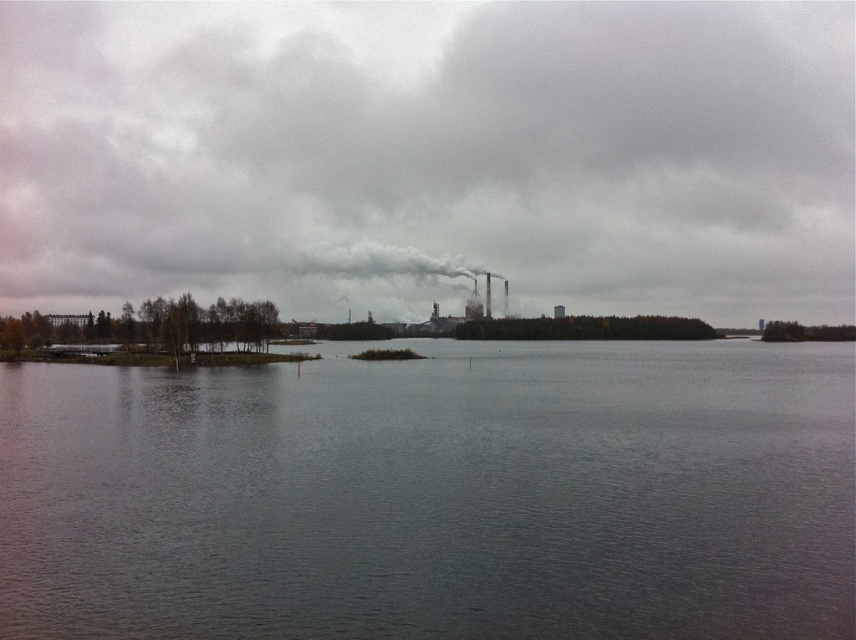
Question: Which of the following is the farthest from the observer?

Choices:
 (A) (378, 252)
 (B) (355, 413)

Answer: (A)

Question: Can you confirm if gray water at center is bigger than white smoke at center?

Choices:
 (A) no
 (B) yes

Answer: (A)

Question: Is gray water at center wider than white smoke at center?

Choices:
 (A) yes
 (B) no

Answer: (A)

Question: Among these points, which one is farthest from the camera?

Choices:
 (A) (480, 285)
 (B) (96, 452)

Answer: (A)

Question: Is gray water at center below white smoke at center?

Choices:
 (A) no
 (B) yes

Answer: (B)

Question: Which object is farther from the camera taking this photo?

Choices:
 (A) white smoke at center
 (B) gray water at center

Answer: (A)